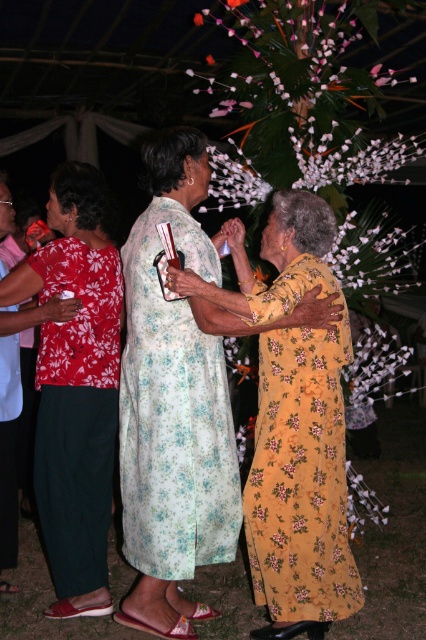
Question: Which point appears closest to the camera in this image?

Choices:
 (A) (371, 342)
 (B) (160, 353)
 (C) (317, 502)

Answer: (C)

Question: Estimate the real-world distances between objects in this image. Which object is closer to the yellow floral dress at center?

Choices:
 (A) floral fabric dress at center
 (B) white floral garland at center
 (C) floral cotton dress at center

Answer: (A)

Question: Can you confirm if yellow floral dress at center is thinner than white paper flower at center?

Choices:
 (A) yes
 (B) no

Answer: (B)

Question: Does floral fabric dress at left appear over white paper flower at center?

Choices:
 (A) yes
 (B) no

Answer: (A)

Question: Does floral fabric dress at left have a larger size compared to white paper flower at center?

Choices:
 (A) no
 (B) yes

Answer: (B)

Question: Which is farther from the white paper flower at center?

Choices:
 (A) floral cotton dress at center
 (B) white floral garland at center
 (C) floral fabric dress at left

Answer: (C)